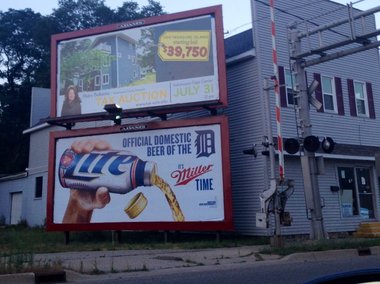
I want to click on glass, so click(361, 179).